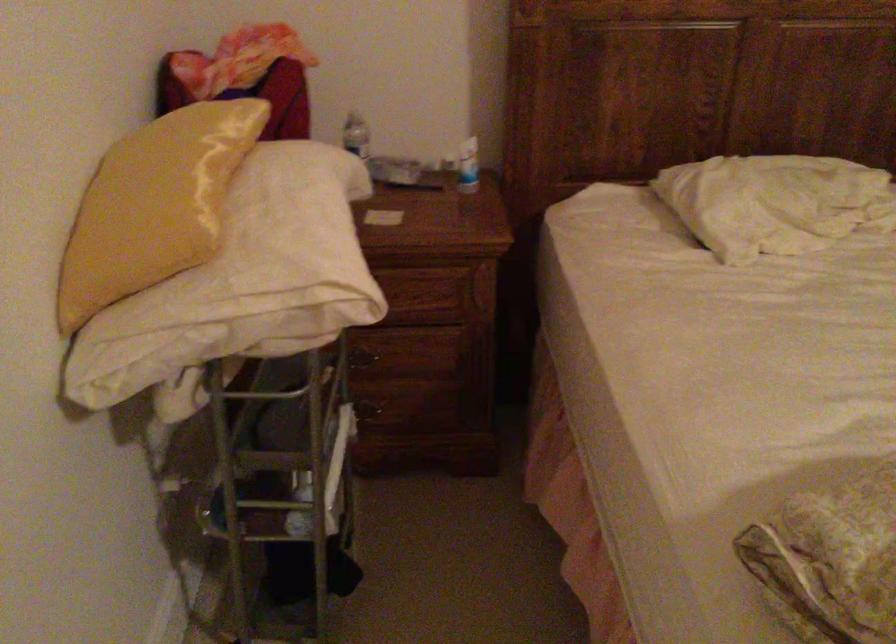
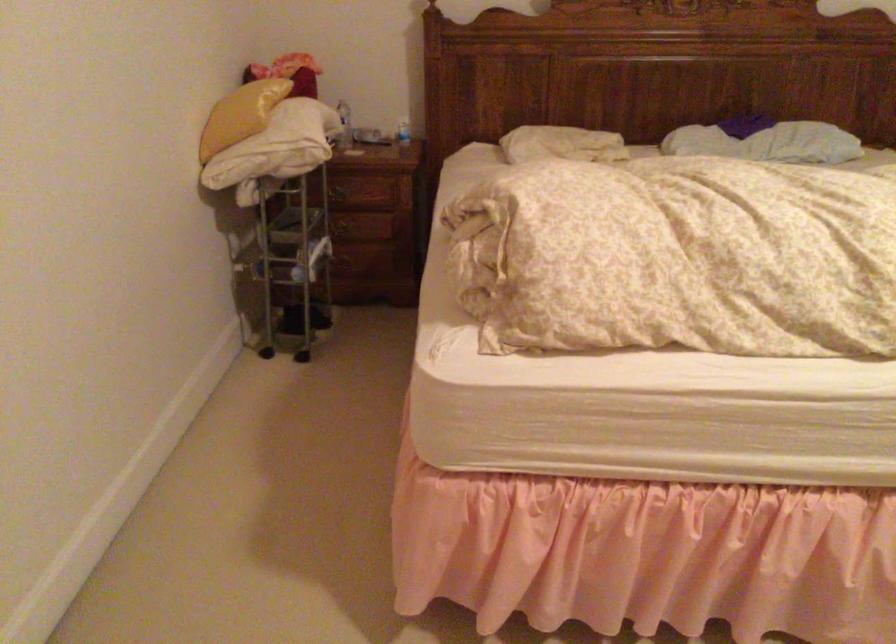
Locate, in the second image, the point that corresponds to the point at 779,211 in the first image.

(561, 144)